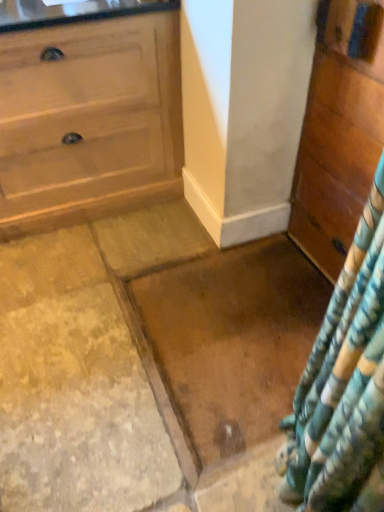
The height and width of the screenshot is (512, 384). Describe the element at coordinates (232, 339) in the screenshot. I see `brown polished granite at center` at that location.

In order to face brown polished granite at center, should I rotate leftwards or rightwards?

It's best to rotate right around 8.175 degrees.

Image resolution: width=384 pixels, height=512 pixels. Find the location of `brown polished granite at center`. brown polished granite at center is located at coordinates (232, 339).

The width and height of the screenshot is (384, 512). What do you see at coordinates (338, 137) in the screenshot?
I see `wooden chest of drawers at right` at bounding box center [338, 137].

Locate an element on the screen. This screenshot has height=512, width=384. wooden chest of drawers at right is located at coordinates (338, 137).

In order to click on brown polished granite at center in this screenshot , I will do `click(232, 339)`.

Does brown polished granite at center appear on the right side of wooden chest of drawers at right?

No, brown polished granite at center is not to the right of wooden chest of drawers at right.

Is brown polished granite at center further to camera compared to wooden chest of drawers at right?

Yes, it is.

Does point (193, 404) appear closer or farther from the camera than point (297, 211)?

Point (193, 404) is positioned closer to the camera compared to point (297, 211).

From the image's perspective, is brown polished granite at center below wooden chest of drawers at right?

Indeed, from the image's perspective, brown polished granite at center is shown beneath wooden chest of drawers at right.

From the picture: From a real-world perspective, is brown polished granite at center located beneath wooden chest of drawers at right?

Yes, from a real-world perspective, brown polished granite at center is below wooden chest of drawers at right.

Which of these two, brown polished granite at center or wooden chest of drawers at right, is thinner?

With smaller width is wooden chest of drawers at right.

Between brown polished granite at center and wooden chest of drawers at right, which one has more height?

wooden chest of drawers at right is taller.

Looking at the image, does brown polished granite at center seem bigger or smaller compared to wooden chest of drawers at right?

Clearly, brown polished granite at center is smaller in size than wooden chest of drawers at right.

Is brown polished granite at center positioned beyond the bounds of wooden chest of drawers at right?

That's correct, brown polished granite at center is outside of wooden chest of drawers at right.

Are brown polished granite at center and wooden chest of drawers at right located far from each other?

No, there isn't a large distance between brown polished granite at center and wooden chest of drawers at right.

Is brown polished granite at center oriented away from wooden chest of drawers at right?

No, brown polished granite at center's orientation is not away from wooden chest of drawers at right.

Consider the image. How many degrees apart are the facing directions of brown polished granite at center and wooden chest of drawers at right?

There is a 1.32-degree angle between the facing directions of brown polished granite at center and wooden chest of drawers at right.

Locate an element on the screen. This screenshot has height=512, width=384. granite behind the wooden chest of drawers at right is located at coordinates (232, 339).

Visually, is wooden chest of drawers at right positioned to the left or to the right of brown polished granite at center?

Clearly, wooden chest of drawers at right is on the right of brown polished granite at center in the image.

Is wooden chest of drawers at right further to the viewer compared to brown polished granite at center?

No, it is not.

Is point (360, 180) closer to viewer compared to point (206, 362)?

Yes, point (360, 180) is closer to viewer.

From the image's perspective, between wooden chest of drawers at right and brown polished granite at center, who is located below?

brown polished granite at center.

From a real-world perspective, is wooden chest of drawers at right located higher than brown polished granite at center?

Yes.

Considering the sizes of wooden chest of drawers at right and brown polished granite at center in the image, is wooden chest of drawers at right wider or thinner than brown polished granite at center?

Clearly, wooden chest of drawers at right has less width compared to brown polished granite at center.

Considering the sizes of wooden chest of drawers at right and brown polished granite at center in the image, is wooden chest of drawers at right taller or shorter than brown polished granite at center?

Considering their sizes, wooden chest of drawers at right has more height than brown polished granite at center.

Considering the sizes of objects wooden chest of drawers at right and brown polished granite at center in the image provided, who is smaller, wooden chest of drawers at right or brown polished granite at center?

With smaller size is brown polished granite at center.

Is wooden chest of drawers at right completely or partially outside of brown polished granite at center?

That's correct, wooden chest of drawers at right is outside of brown polished granite at center.

Is wooden chest of drawers at right in contact with brown polished granite at center?

No, wooden chest of drawers at right is not next to brown polished granite at center.

Could you tell me if wooden chest of drawers at right is facing brown polished granite at center?

Yes, wooden chest of drawers at right is aimed at brown polished granite at center.

How many degrees apart are the facing directions of wooden chest of drawers at right and brown polished granite at center?

The facing directions of wooden chest of drawers at right and brown polished granite at center are 1.32 degrees apart.

This screenshot has height=512, width=384. Identify the location of chest of drawers on the right side of brown polished granite at center. (338, 137).

The image size is (384, 512). I want to click on granite behind the wooden chest of drawers at right, so click(x=232, y=339).

Find the location of a particular element. This screenshot has width=384, height=512. granite below the wooden chest of drawers at right (from a real-world perspective) is located at coordinates (232, 339).